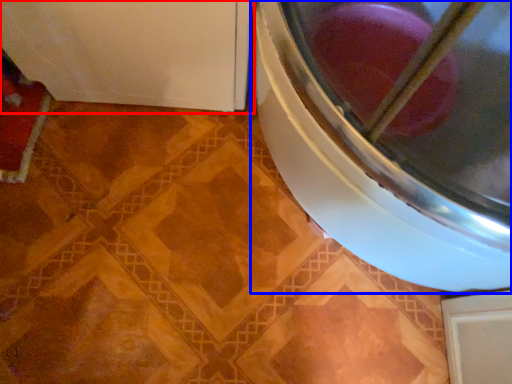
Question: Among these objects, which one is nearest to the camera, appliance (highlighted by a red box) or washing machine (highlighted by a blue box)?

Choices:
 (A) appliance
 (B) washing machine

Answer: (B)